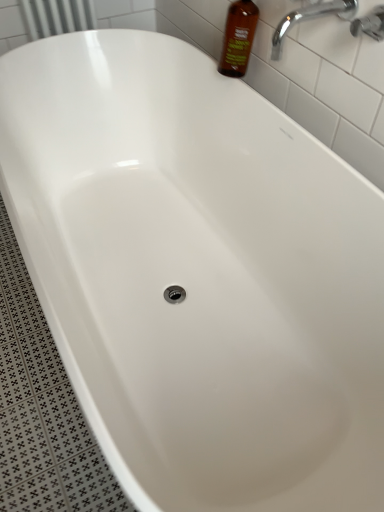
Question: From a real-world perspective, is chrome metallic faucet at upper right above or below brown glass bottle at upper right?

Choices:
 (A) below
 (B) above

Answer: (B)

Question: Looking at their shapes, would you say chrome metallic faucet at upper right is wider or thinner than brown glass bottle at upper right?

Choices:
 (A) thin
 (B) wide

Answer: (B)

Question: Which object is the closest to the brown glass bottle at upper right?

Choices:
 (A) chrome metallic faucet at upper right
 (B) chrome metallic faucet at upper right

Answer: (A)

Question: Estimate the real-world distances between objects in this image. Which object is farther from the brown glass bottle at upper right?

Choices:
 (A) chrome metallic faucet at upper right
 (B) chrome metallic faucet at upper right

Answer: (A)